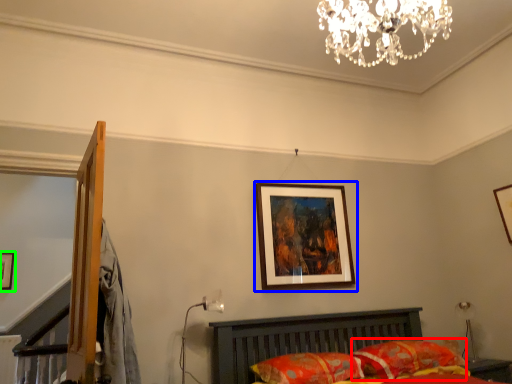
Question: Based on their relative distances, which object is farther from pillow (highlighted by a red box)? Choose from picture frame (highlighted by a blue box) and picture frame (highlighted by a green box).

Choices:
 (A) picture frame
 (B) picture frame

Answer: (B)